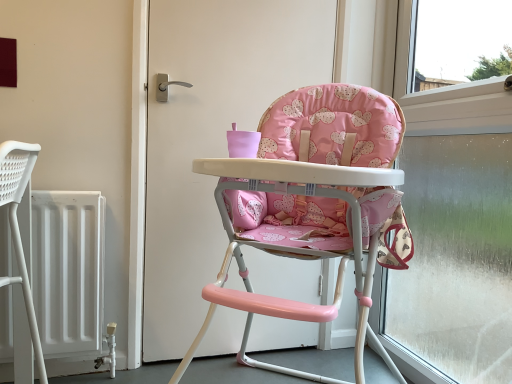
Question: Can you confirm if transparent glass window at right is positioned to the left of pink fabric highchair at center?

Choices:
 (A) no
 (B) yes

Answer: (A)

Question: Is transparent glass window at right closer to camera compared to pink fabric highchair at center?

Choices:
 (A) no
 (B) yes

Answer: (A)

Question: Is transparent glass window at right located outside pink fabric highchair at center?

Choices:
 (A) yes
 (B) no

Answer: (A)

Question: Is transparent glass window at right beside pink fabric highchair at center?

Choices:
 (A) yes
 (B) no

Answer: (B)

Question: Is transparent glass window at right to the right of pink fabric highchair at center from the viewer's perspective?

Choices:
 (A) no
 (B) yes

Answer: (B)

Question: In terms of width, does pink fabric highchair at center look wider or thinner when compared to white matte door at center?

Choices:
 (A) thin
 (B) wide

Answer: (B)

Question: Relative to white matte door at center, is pink fabric highchair at center in front or behind?

Choices:
 (A) front
 (B) behind

Answer: (A)

Question: From the image's perspective, is pink fabric highchair at center located above or below white matte door at center?

Choices:
 (A) below
 (B) above

Answer: (A)

Question: From a real-world perspective, is pink fabric highchair at center positioned above or below white matte door at center?

Choices:
 (A) above
 (B) below

Answer: (B)

Question: Is pink fabric highchair at center to the left or to the right of transparent glass window at right in the image?

Choices:
 (A) left
 (B) right

Answer: (A)

Question: Considering the positions of point (382, 142) and point (422, 160), is point (382, 142) closer or farther from the camera than point (422, 160)?

Choices:
 (A) farther
 (B) closer

Answer: (B)

Question: In terms of width, does pink fabric highchair at center look wider or thinner when compared to transparent glass window at right?

Choices:
 (A) wide
 (B) thin

Answer: (A)

Question: Which is correct: pink fabric highchair at center is inside transparent glass window at right, or outside of it?

Choices:
 (A) inside
 (B) outside

Answer: (B)

Question: Visually, is white matte door at center positioned to the left or to the right of pink fabric highchair at center?

Choices:
 (A) right
 (B) left

Answer: (B)

Question: From the image's perspective, relative to pink fabric highchair at center, is white matte door at center above or below?

Choices:
 (A) below
 (B) above

Answer: (B)